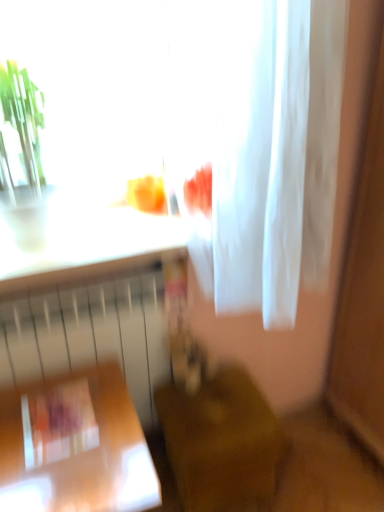
This screenshot has height=512, width=384. Describe the element at coordinates (277, 155) in the screenshot. I see `white sheer fabric at upper center` at that location.

What do you see at coordinates (58, 423) in the screenshot?
I see `matte plastic book at lower left` at bounding box center [58, 423].

This screenshot has height=512, width=384. What do you see at coordinates (90, 335) in the screenshot? I see `white matte radiator at lower left` at bounding box center [90, 335].

In order to face wooden chair at lower center, which is the 2th furniture from left to right, should I rotate leftwards or rightwards?

It's best to rotate right around 2.796 degrees.

This screenshot has width=384, height=512. I want to click on white sheer fabric at upper center, so click(277, 155).

Is point (320, 273) more distant than point (215, 482)?

Yes, point (320, 273) is behind point (215, 482).

Is white sheer fabric at upper center wider or thinner than wooden chair at lower center, which is counted as the 1th furniture, starting from the right?

In the image, white sheer fabric at upper center appears to be wider than wooden chair at lower center, which is counted as the 1th furniture, starting from the right.

From the image's perspective, starting from the white sheer fabric at upper center, which furniture is the 1st one below? Please provide its 2D coordinates.

[(220, 442)]

Which object is thinner, matte plastic book at lower left or white sheer fabric at upper center?

matte plastic book at lower left is thinner.

Who is more distant, matte plastic book at lower left or white sheer fabric at upper center?

matte plastic book at lower left is further from the camera.

From a real-world perspective, which is physically above, matte plastic book at lower left or white sheer fabric at upper center?

white sheer fabric at upper center is physically above.

Is white sheer fabric at upper center at the back of matte plastic book at lower left?

No.

Is wooden table at lower left, positioned as the first furniture in left-to-right order, at the back of matte plastic book at lower left?

Correct, matte plastic book at lower left is looking away from wooden table at lower left, positioned as the first furniture in left-to-right order.

Are matte plastic book at lower left and wooden table at lower left, the second furniture viewed from the right, beside each other?

Yes, matte plastic book at lower left is with wooden table at lower left, the second furniture viewed from the right.

Considering the positions of objects matte plastic book at lower left and wooden table at lower left, the second furniture viewed from the right, in the image provided, who is more to the right, matte plastic book at lower left or wooden table at lower left, the second furniture viewed from the right,?

wooden table at lower left, the second furniture viewed from the right.

Looking at the image, does matte plastic book at lower left seem bigger or smaller compared to wooden table at lower left, the second furniture viewed from the right?

Considering their sizes, matte plastic book at lower left takes up less space than wooden table at lower left, the second furniture viewed from the right.

Do you think matte plastic book at lower left is within white matte radiator at lower left, or outside of it?

matte plastic book at lower left cannot be found inside white matte radiator at lower left.

Which is closer, (x=97, y=430) or (x=72, y=297)?

Point (x=97, y=430) is positioned closer to the camera compared to point (x=72, y=297).

Considering the sizes of objects matte plastic book at lower left and white matte radiator at lower left in the image provided, who is shorter, matte plastic book at lower left or white matte radiator at lower left?

With less height is matte plastic book at lower left.

From the image's perspective, relative to white matte radiator at lower left, is wooden table at lower left, positioned as the first furniture in left-to-right order, above or below?

Clearly, from the image's perspective, wooden table at lower left, positioned as the first furniture in left-to-right order, is below white matte radiator at lower left.

Who is taller, wooden table at lower left, the second furniture viewed from the right, or white matte radiator at lower left?

white matte radiator at lower left is taller.

How far apart are wooden table at lower left, the second furniture viewed from the right, and white matte radiator at lower left?

wooden table at lower left, the second furniture viewed from the right, is 7.89 inches away from white matte radiator at lower left.

Considering the points (132, 428) and (77, 362), which point is behind, point (132, 428) or point (77, 362)?

The point (77, 362) is farther.

From a real-world perspective, is wooden chair at lower center, which is the 2th furniture from left to right, above or below white matte radiator at lower left?

wooden chair at lower center, which is the 2th furniture from left to right, is below white matte radiator at lower left.

Looking at this image, considering the sizes of objects wooden chair at lower center, which is the 2th furniture from left to right, and white matte radiator at lower left in the image provided, who is bigger, wooden chair at lower center, which is the 2th furniture from left to right, or white matte radiator at lower left?

Bigger between the two is white matte radiator at lower left.

Are wooden chair at lower center, which is counted as the 1th furniture, starting from the right, and white matte radiator at lower left beside each other?

No.

Does point (208, 502) come closer to viewer compared to point (139, 313)?

Yes, it is.

Can you confirm if wooden chair at lower center, which is counted as the 1th furniture, starting from the right, is taller than wooden table at lower left, the second furniture viewed from the right?

In fact, wooden chair at lower center, which is counted as the 1th furniture, starting from the right, may be shorter than wooden table at lower left, the second furniture viewed from the right.

Does wooden chair at lower center, which is the 2th furniture from left to right, have a larger size compared to wooden table at lower left, positioned as the first furniture in left-to-right order?

Incorrect, wooden chair at lower center, which is the 2th furniture from left to right, is not larger than wooden table at lower left, positioned as the first furniture in left-to-right order.

From the picture: Is wooden chair at lower center, which is the 2th furniture from left to right, wider or thinner than wooden table at lower left, positioned as the first furniture in left-to-right order?

In the image, wooden chair at lower center, which is the 2th furniture from left to right, appears to be more narrow than wooden table at lower left, positioned as the first furniture in left-to-right order.

At what (x,y) coordinates should I click in order to perform the action: click on furniture that is the 2nd one when counting backward from the white sheer fabric at upper center. Please return your answer as a coordinate pair (x, y). This screenshot has width=384, height=512. Looking at the image, I should click on (220, 442).

This screenshot has height=512, width=384. In order to click on square on the left of the white sheer fabric at upper center in this screenshot , I will do `click(58, 423)`.

Based on their spatial positions, is wooden table at lower left, the second furniture viewed from the right, or wooden chair at lower center, which is the 2th furniture from left to right, further from white sheer fabric at upper center?

wooden table at lower left, the second furniture viewed from the right, is positioned further to the anchor white sheer fabric at upper center.

From the image, which object appears to be nearer to wooden table at lower left, positioned as the first furniture in left-to-right order, wooden chair at lower center, which is counted as the 1th furniture, starting from the right, or white sheer fabric at upper center?

wooden chair at lower center, which is counted as the 1th furniture, starting from the right, lies closer to wooden table at lower left, positioned as the first furniture in left-to-right order, than the other object.

Considering their positions, is white matte radiator at lower left positioned further to wooden chair at lower center, which is the 2th furniture from left to right, than wooden table at lower left, positioned as the first furniture in left-to-right order?

wooden table at lower left, positioned as the first furniture in left-to-right order, lies further to wooden chair at lower center, which is the 2th furniture from left to right, than the other object.

From the image, which object appears to be farther from white matte radiator at lower left, matte plastic book at lower left or wooden chair at lower center, which is the 2th furniture from left to right?

Based on the image, wooden chair at lower center, which is the 2th furniture from left to right, appears to be further to white matte radiator at lower left.

Which object lies nearer to the anchor point wooden chair at lower center, which is the 2th furniture from left to right, white sheer fabric at upper center or matte plastic book at lower left?

The object closer to wooden chair at lower center, which is the 2th furniture from left to right, is matte plastic book at lower left.

Based on their spatial positions, is wooden table at lower left, the second furniture viewed from the right, or wooden chair at lower center, which is counted as the 1th furniture, starting from the right, further from white matte radiator at lower left?

wooden chair at lower center, which is counted as the 1th furniture, starting from the right.

Estimate the real-world distances between objects in this image. Which object is closer to matte plastic book at lower left, white matte radiator at lower left or white sheer fabric at upper center?

white matte radiator at lower left is positioned closer to the anchor matte plastic book at lower left.

Which object lies nearer to the anchor point white matte radiator at lower left, white sheer fabric at upper center or wooden chair at lower center, which is the 2th furniture from left to right?

Based on the image, wooden chair at lower center, which is the 2th furniture from left to right, appears to be nearer to white matte radiator at lower left.

Locate an element on the screen. radiator located between matte plastic book at lower left and wooden chair at lower center, which is counted as the 1th furniture, starting from the right, in the left-right direction is located at coordinates (90, 335).

I want to click on radiator that lies between white sheer fabric at upper center and wooden table at lower left, the second furniture viewed from the right, from top to bottom, so click(x=90, y=335).

Find the location of `square between white sheer fabric at upper center and wooden table at lower left, the second furniture viewed from the right, in the vertical direction`. square between white sheer fabric at upper center and wooden table at lower left, the second furniture viewed from the right, in the vertical direction is located at coordinates (58, 423).

Locate an element on the screen. square positioned between wooden table at lower left, positioned as the first furniture in left-to-right order, and white matte radiator at lower left from near to far is located at coordinates (58, 423).